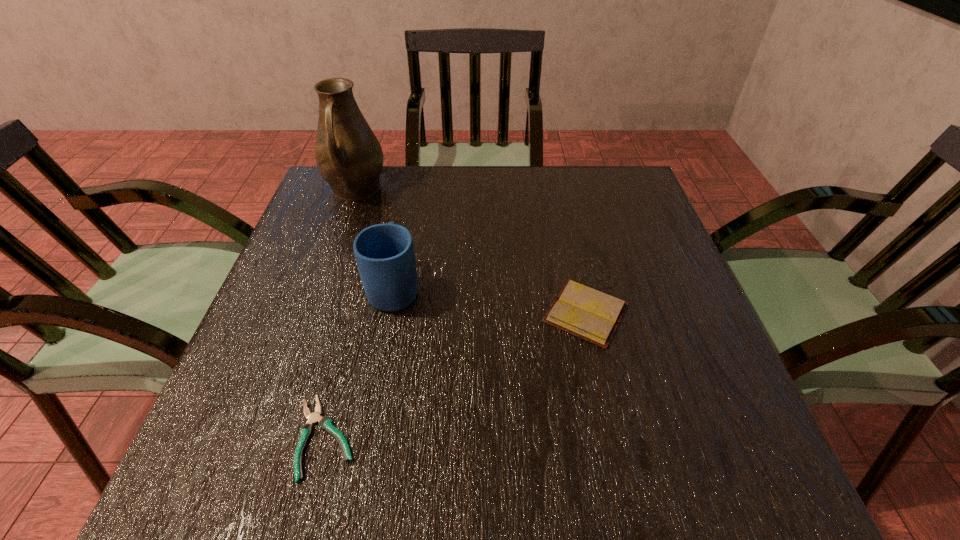
Where is `free space at the far edge of the desktop`? free space at the far edge of the desktop is located at coordinates (480, 173).

Where is `free space at the left edge of the desktop`? Image resolution: width=960 pixels, height=540 pixels. free space at the left edge of the desktop is located at coordinates (248, 385).

Find the location of a particular element. The image size is (960, 540). free space at the right edge of the desktop is located at coordinates (653, 282).

I want to click on blank area at the far left corner, so click(306, 213).

Find the location of a particular element. vacant space at the near right corner of the desktop is located at coordinates coord(739,494).

Locate an element on the screen. free space between the nearest object and the pitcher is located at coordinates (341, 314).

At what (x,y) coordinates should I click in order to perform the action: click on unoccupied position between the nearest object and the mug. Please return your answer as a coordinate pair (x, y). The height and width of the screenshot is (540, 960). Looking at the image, I should click on (360, 362).

Locate an element on the screen. This screenshot has height=540, width=960. free spot between the third shortest object and the third tallest object is located at coordinates (491, 300).

Locate an element on the screen. The image size is (960, 540). free spot between the mug and the shortest object is located at coordinates (360, 362).

Where is `vacant space in between the rightmost object and the third shortest object`? vacant space in between the rightmost object and the third shortest object is located at coordinates (491, 300).